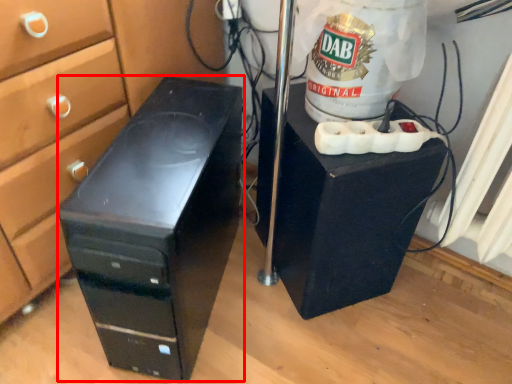
Question: From the image's perspective, where is furniture (annotated by the red box) located in relation to furniture in the image?

Choices:
 (A) below
 (B) above

Answer: (A)